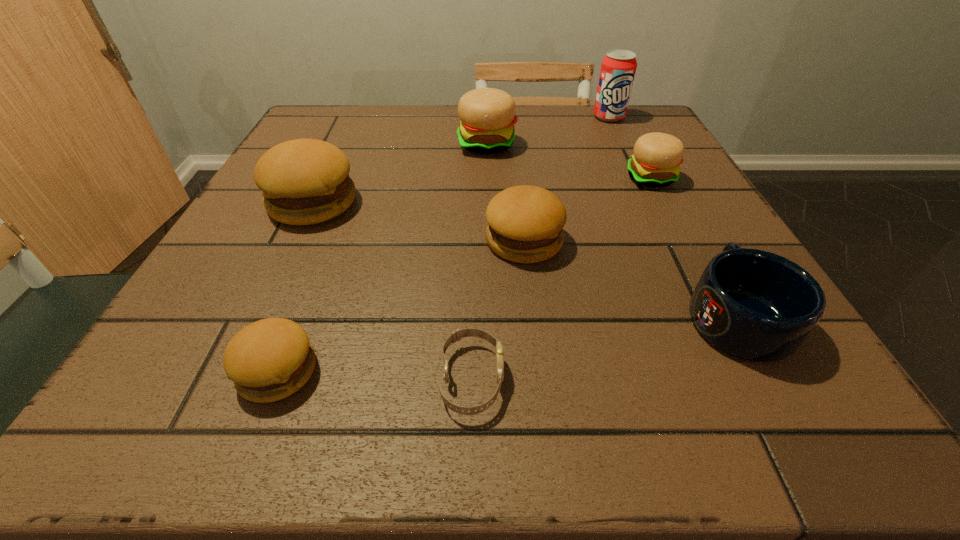
The width and height of the screenshot is (960, 540). I want to click on the farthest object, so click(618, 68).

Find the location of `the tallest object`. the tallest object is located at coordinates (618, 68).

Where is `the farthest hamburger`? This screenshot has width=960, height=540. the farthest hamburger is located at coordinates (487, 115).

Locate an element on the screen. The width and height of the screenshot is (960, 540). the second farthest object is located at coordinates (487, 115).

The height and width of the screenshot is (540, 960). I want to click on the biggest brown hamburger, so click(304, 181).

Locate an element on the screen. the second biggest brown hamburger is located at coordinates (525, 223).

The height and width of the screenshot is (540, 960). What are the coordinates of `the smaller beige hamburger` in the screenshot? It's located at pos(656,161).

I want to click on the rightmost hamburger, so click(656, 161).

Identify the location of mug. (755, 305).

The image size is (960, 540). I want to click on the smallest brown hamburger, so click(268, 360).